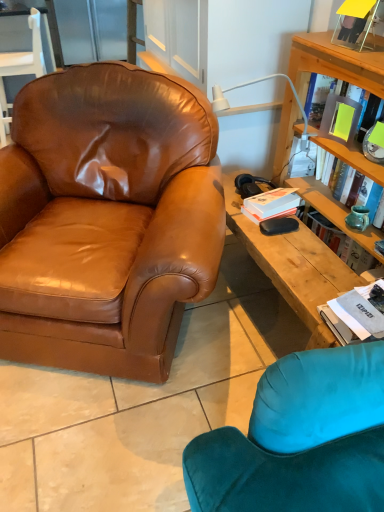
Question: Is yellow matte book at upper right, which is counted as the first book, starting from the top, at the back of brown leather armchair at upper left, placed as the 2th chair when sorted from bottom to top?

Choices:
 (A) no
 (B) yes

Answer: (A)

Question: Does brown leather armchair at upper left, placed as the 2th chair when sorted from bottom to top, lie in front of yellow matte book at upper right, which is counted as the first book, starting from the top?

Choices:
 (A) no
 (B) yes

Answer: (A)

Question: Is brown leather armchair at upper left, the first chair positioned from the top, aimed at yellow matte book at upper right, the 1th book when ordered from back to front?

Choices:
 (A) yes
 (B) no

Answer: (B)

Question: Is brown leather armchair at upper left, which is the first chair in left-to-right order, bigger than yellow matte book at upper right, the second book in the bottom-to-top sequence?

Choices:
 (A) yes
 (B) no

Answer: (A)

Question: Is brown leather armchair at upper left, which is counted as the second chair, starting from the right, further to camera compared to yellow matte book at upper right, placed as the 2th book when sorted from front to back?

Choices:
 (A) no
 (B) yes

Answer: (B)

Question: In the image, is white plastic lamp at upper right on the left side or the right side of brown leather armchair at upper left, which is counted as the second chair, starting from the right?

Choices:
 (A) right
 (B) left

Answer: (A)

Question: From a real-world perspective, is white plastic lamp at upper right positioned above or below brown leather armchair at upper left, which is counted as the second chair, starting from the right?

Choices:
 (A) above
 (B) below

Answer: (A)

Question: Considering their positions, is white plastic lamp at upper right located in front of or behind brown leather armchair at upper left, marked as the second chair in a front-to-back arrangement?

Choices:
 (A) front
 (B) behind

Answer: (A)

Question: From their relative heights in the image, would you say white plastic lamp at upper right is taller or shorter than brown leather armchair at upper left, placed as the 2th chair when sorted from bottom to top?

Choices:
 (A) tall
 (B) short

Answer: (B)

Question: Is white matte paperback book at upper right wider or thinner than brown leather chair at left, the 1th chair ordered from the bottom?

Choices:
 (A) wide
 (B) thin

Answer: (B)

Question: In the image, is white matte paperback book at upper right on the left side or the right side of brown leather chair at left, the second chair from the left?

Choices:
 (A) left
 (B) right

Answer: (B)

Question: Is point (271, 212) closer or farther from the camera than point (54, 194)?

Choices:
 (A) farther
 (B) closer

Answer: (B)

Question: In the image, is white matte paperback book at upper right positioned in front of or behind brown leather chair at left, placed as the second chair when sorted from back to front?

Choices:
 (A) behind
 (B) front

Answer: (A)

Question: Considering their positions, is brown leather armchair at upper left, the first chair positioned from the top, located in front of or behind white plastic lamp at upper right?

Choices:
 (A) front
 (B) behind

Answer: (B)

Question: From the image's perspective, is brown leather armchair at upper left, marked as the second chair in a front-to-back arrangement, above or below white plastic lamp at upper right?

Choices:
 (A) below
 (B) above

Answer: (B)